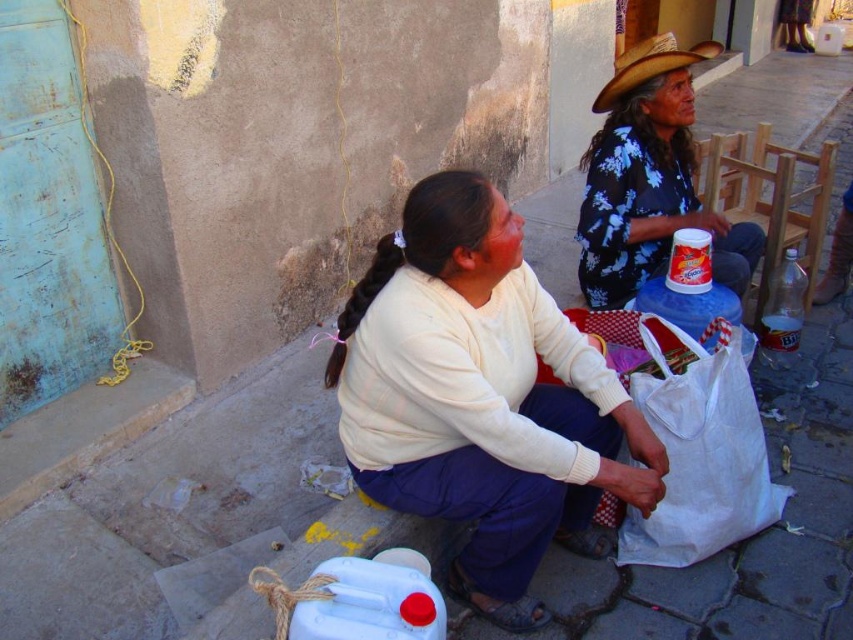
You are a photographer trying to capture a candid shot of the scene. You want to ensure that both the white matte sweater at center and the white plastic bag at lower right are clearly visible in the frame. Considering their sizes, which object should you focus on first to ensure proper focus?

The white matte sweater at center is taller than the white plastic bag at lower right, so focusing on the white matte sweater at center first will ensure proper focus as it is larger in the frame.

You are a delivery person who needs to place a small package on the ground near the woman in the cream sweater. The package must be placed at a point that is 0.1 units to the right and 0.05 units above the point marked as point (480, 397). Where exactly should you place the package?

The package should be placed at the coordinates 0.722, 0.615 because adding 0.1 to the x coordinate and 0.05 to the y coordinate of point (480, 397) gives the new position.

You are a photographer trying to capture the scene with the floral fabric blouse at upper right and the straw textured cowboy hat at upper right. Which object should you adjust your camera to focus on first if you want to capture the one that is more to the right?

The floral fabric blouse at upper right is positioned on the right side of the straw textured cowboy hat at upper right, so you should focus on the floral fabric blouse at upper right first to capture the one more to the right.